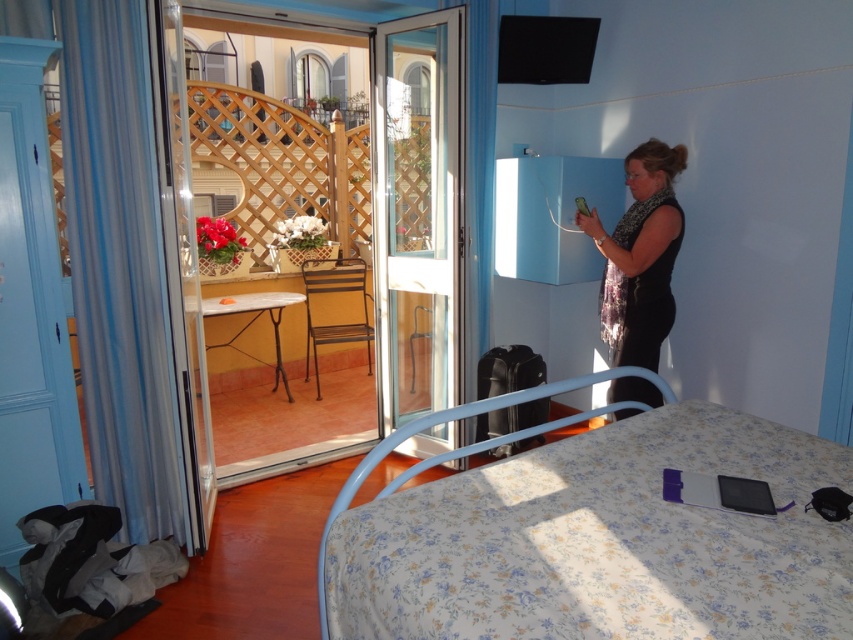
Question: Is floral fabric bed at lower center positioned behind black fabric dress at center?

Choices:
 (A) yes
 (B) no

Answer: (B)

Question: Which of the following is the closest to the observer?

Choices:
 (A) (577, 218)
 (B) (230, 451)

Answer: (A)

Question: Among these objects, which one is farthest from the camera?

Choices:
 (A) clear glass screen door at center
 (B) floral fabric bed at lower center
 (C) black fabric dress at center
 (D) transparent glass door at center

Answer: (D)

Question: Estimate the real-world distances between objects in this image. Which object is closer to the clear glass screen door at center?

Choices:
 (A) floral fabric bed at lower center
 (B) black fabric dress at center
 (C) transparent glass door at center

Answer: (C)

Question: Does floral fabric bed at lower center lie behind black fabric dress at center?

Choices:
 (A) yes
 (B) no

Answer: (B)

Question: Can you confirm if floral fabric bed at lower center is positioned below transparent glass door at center?

Choices:
 (A) yes
 (B) no

Answer: (A)